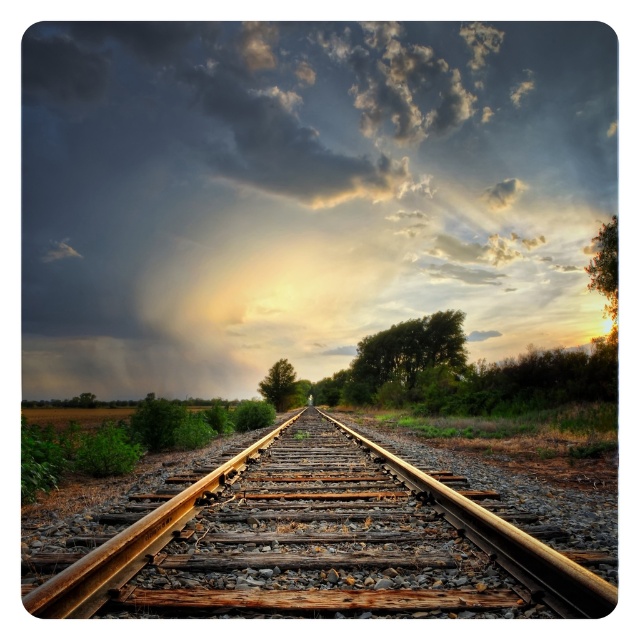
You are a photographer standing at the starting point of the railway. You want to capture the rusty metal train track at center in your photo. Where should you position your camera to ensure the track is centered in the frame?

To center the rusty metal train track at center in your photo, position your camera at the point where the track converges towards the vanishing point, which is at coordinate point (310, 540). This will ensure the track is centered and aligned properly in the frame.

You are an observer standing at the starting point of the railway tracks. You notice a dark gray cloud at upper center and a green leafy tree at upper right. Which object is closer to you?

The dark gray cloud at upper center is closer to you because the green leafy tree at upper right is behind it.